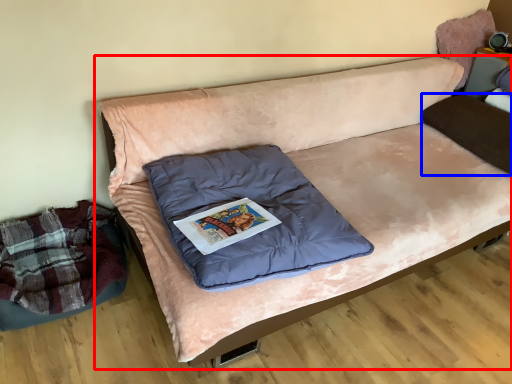
Question: Which point is closer to the camera, studio couch (highlighted by a red box) or pillow (highlighted by a blue box)?

Choices:
 (A) studio couch
 (B) pillow

Answer: (A)